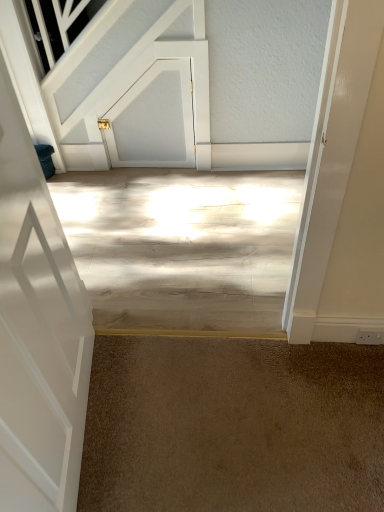
Question: Considering the relative sizes of white glossy door at left, the 2th door from the top, and white matte door at upper center, the 2th door ordered from the bottom, in the image provided, is white glossy door at left, the 2th door from the top, wider than white matte door at upper center, the 2th door ordered from the bottom,?

Choices:
 (A) yes
 (B) no

Answer: (A)

Question: Can you confirm if white glossy door at left, which ranks as the 2th door in back-to-front order, is positioned to the right of white matte door at upper center, the 2th door ordered from the bottom?

Choices:
 (A) yes
 (B) no

Answer: (B)

Question: Is white glossy door at left, the 2th door from the top, aimed at white matte door at upper center, the second door viewed from the front?

Choices:
 (A) no
 (B) yes

Answer: (A)

Question: Is white glossy door at left, the 2th door from the top, far away from white matte door at upper center, the first door viewed from the back?

Choices:
 (A) yes
 (B) no

Answer: (A)

Question: From the image's perspective, is white glossy door at left, which ranks as the 2th door in back-to-front order, located beneath white matte door at upper center, the second door viewed from the front?

Choices:
 (A) no
 (B) yes

Answer: (B)

Question: Is white matte door at upper center, the 1th door viewed from the top, taller or shorter than brown carpet at lower center?

Choices:
 (A) tall
 (B) short

Answer: (A)

Question: Is white matte door at upper center, the 2th door ordered from the bottom, in front of or behind brown carpet at lower center in the image?

Choices:
 (A) behind
 (B) front

Answer: (A)

Question: Considering the positions of white matte door at upper center, the first door viewed from the back, and brown carpet at lower center in the image, is white matte door at upper center, the first door viewed from the back, bigger or smaller than brown carpet at lower center?

Choices:
 (A) small
 (B) big

Answer: (A)

Question: From the image's perspective, is white matte door at upper center, the 1th door viewed from the top, located above or below brown carpet at lower center?

Choices:
 (A) below
 (B) above

Answer: (B)

Question: Relative to white glossy door at left, which ranks as the 2th door in back-to-front order, is white matte door at upper center, the second door viewed from the front, in front or behind?

Choices:
 (A) behind
 (B) front

Answer: (A)

Question: Is white matte door at upper center, the 1th door viewed from the top, inside the boundaries of white glossy door at left, which ranks as the 2th door in back-to-front order, or outside?

Choices:
 (A) inside
 (B) outside

Answer: (B)

Question: From the image's perspective, is white matte door at upper center, the second door viewed from the front, located above or below white glossy door at left, marked as the first door in a front-to-back arrangement?

Choices:
 (A) above
 (B) below

Answer: (A)

Question: Is white matte door at upper center, the 1th door viewed from the top, to the left or to the right of white glossy door at left, marked as the first door in a front-to-back arrangement, in the image?

Choices:
 (A) left
 (B) right

Answer: (B)

Question: Is brown carpet at lower center taller or shorter than white matte door at upper center, the 1th door viewed from the top?

Choices:
 (A) tall
 (B) short

Answer: (B)

Question: From the image's perspective, relative to white matte door at upper center, the 1th door viewed from the top, is brown carpet at lower center above or below?

Choices:
 (A) below
 (B) above

Answer: (A)